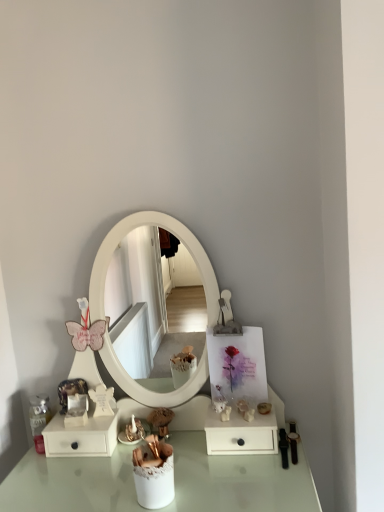
Locate an element on the screen. The height and width of the screenshot is (512, 384). blank space above white matte drawer at lower left, positioned as the 1th dresser in left-to-right order (from a real-world perspective) is located at coordinates click(74, 418).